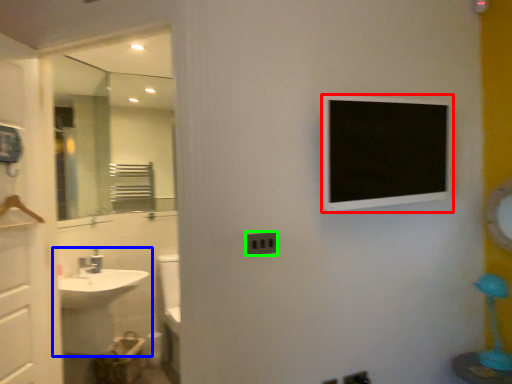
Question: Based on their relative distances, which object is farther from medicine cabinet (highlighted by a red box)? Choose from sink (highlighted by a blue box) and electric outlet (highlighted by a green box).

Choices:
 (A) sink
 (B) electric outlet

Answer: (A)